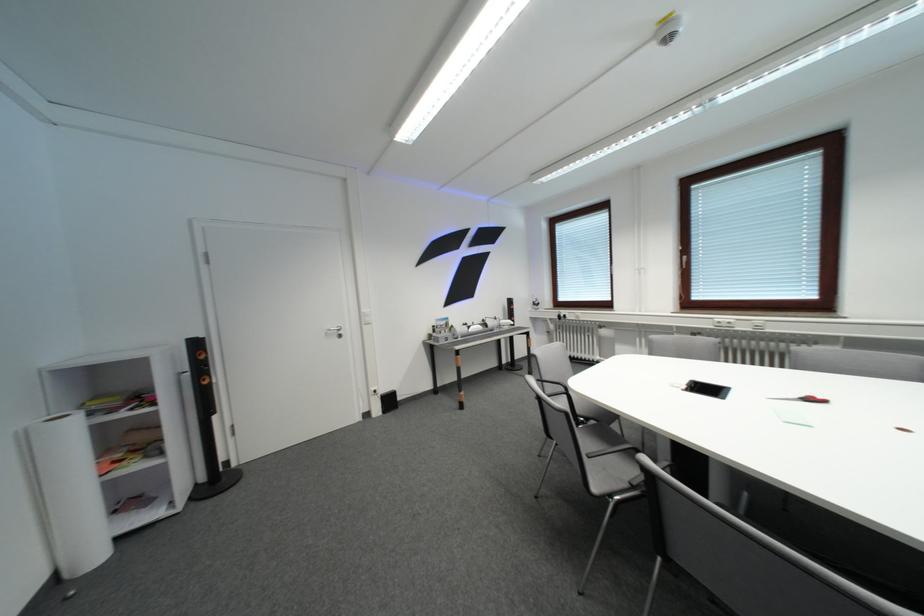
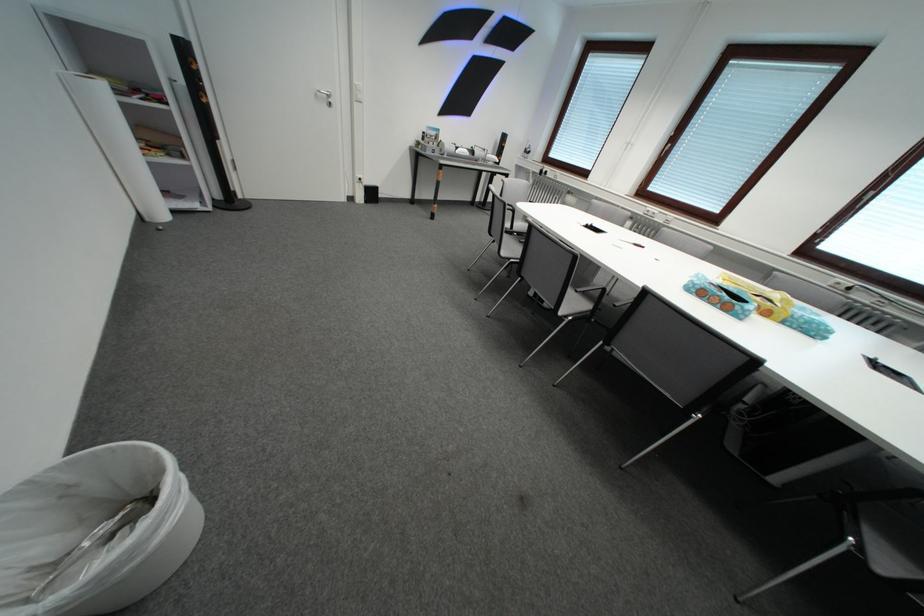
In the second image, find the point that corresponds to point 440,339 in the first image.

(429, 146)